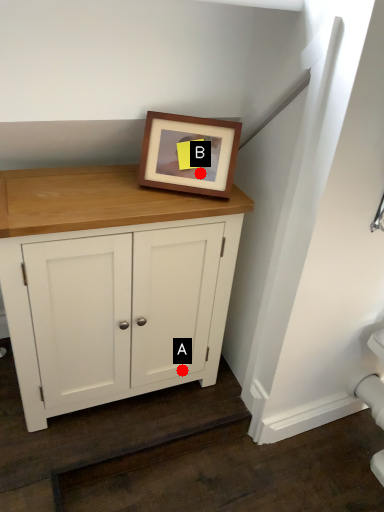
Question: Two points are circled on the image, labeled by A and B beside each circle. Which point is closer to the camera taking this photo?

Choices:
 (A) A is closer
 (B) B is closer

Answer: (B)